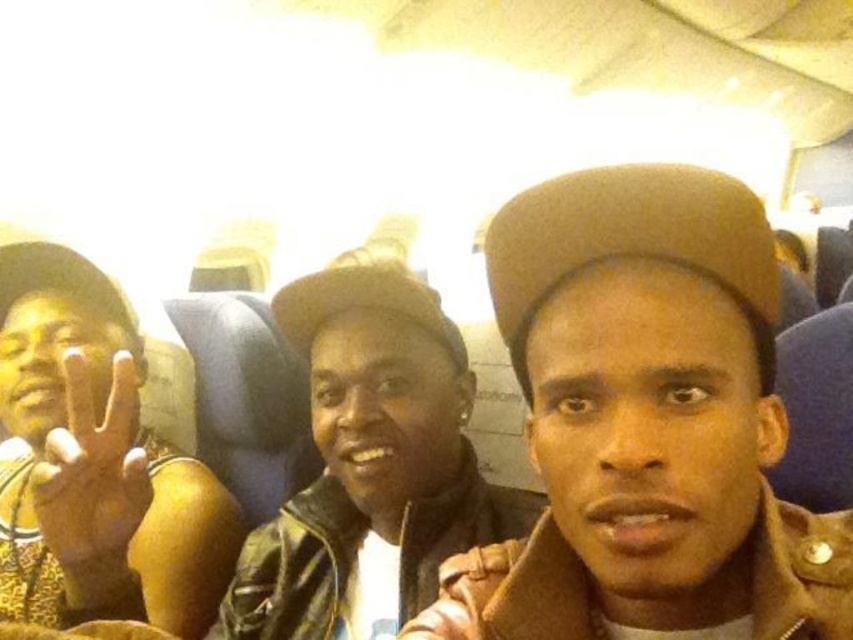
Question: Does brown leather jacket at center appear over yellow matte hand at left?

Choices:
 (A) no
 (B) yes

Answer: (B)

Question: Which point is closer to the camera?

Choices:
 (A) brown leather jacket at center
 (B) yellow matte hand at left
 (C) leather jacket at center

Answer: (A)

Question: Can you confirm if brown leather jacket at center is positioned to the right of yellow matte hand at left?

Choices:
 (A) yes
 (B) no

Answer: (A)

Question: Can you confirm if brown leather jacket at center is smaller than yellow printed shirt at left?

Choices:
 (A) no
 (B) yes

Answer: (B)

Question: Which object is farther from the camera taking this photo?

Choices:
 (A) yellow printed shirt at left
 (B) yellow matte hand at left

Answer: (A)

Question: Which of these objects is positioned farthest from the brown leather jacket at center?

Choices:
 (A) yellow printed shirt at left
 (B) leather jacket at center
 (C) yellow matte hand at left

Answer: (A)